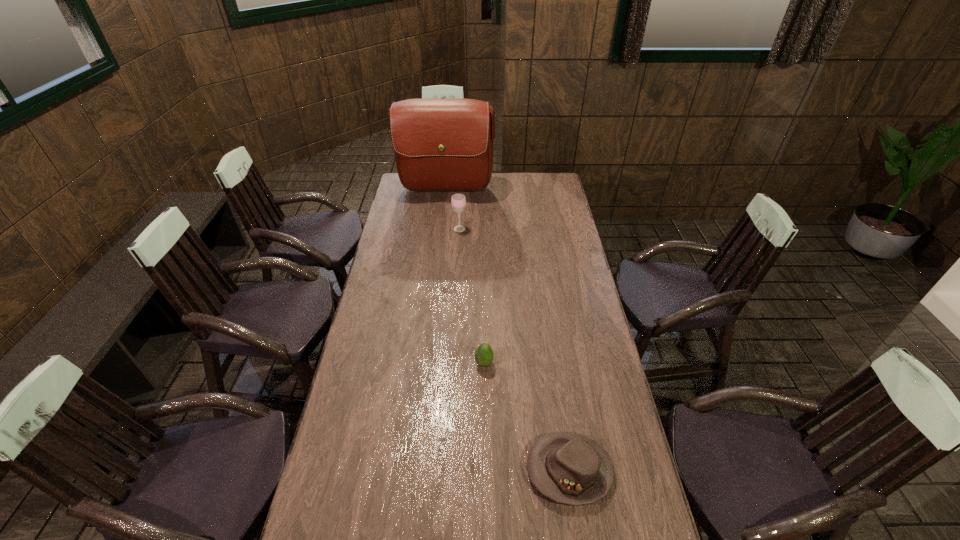
Locate an element on the screen. the tallest object is located at coordinates (439, 144).

Find the location of `the farthest object`. the farthest object is located at coordinates (439, 144).

The height and width of the screenshot is (540, 960). Find the location of `the second farthest object`. the second farthest object is located at coordinates (458, 201).

Where is `the second tallest object`? the second tallest object is located at coordinates (458, 201).

This screenshot has height=540, width=960. I want to click on the second nearest object, so click(x=484, y=355).

Find the location of a particular element. hat is located at coordinates (569, 468).

Image resolution: width=960 pixels, height=540 pixels. In order to click on the nearest object in this screenshot , I will do `click(569, 468)`.

Locate an element on the screen. vacant space situated 0.130m on the open flap of the satchel is located at coordinates [444, 218].

The height and width of the screenshot is (540, 960). I want to click on free region located 0.050m on the front of the third shortest object, so click(459, 239).

Where is `free region located 0.320m on the front of the avocado`? This screenshot has width=960, height=540. free region located 0.320m on the front of the avocado is located at coordinates (485, 460).